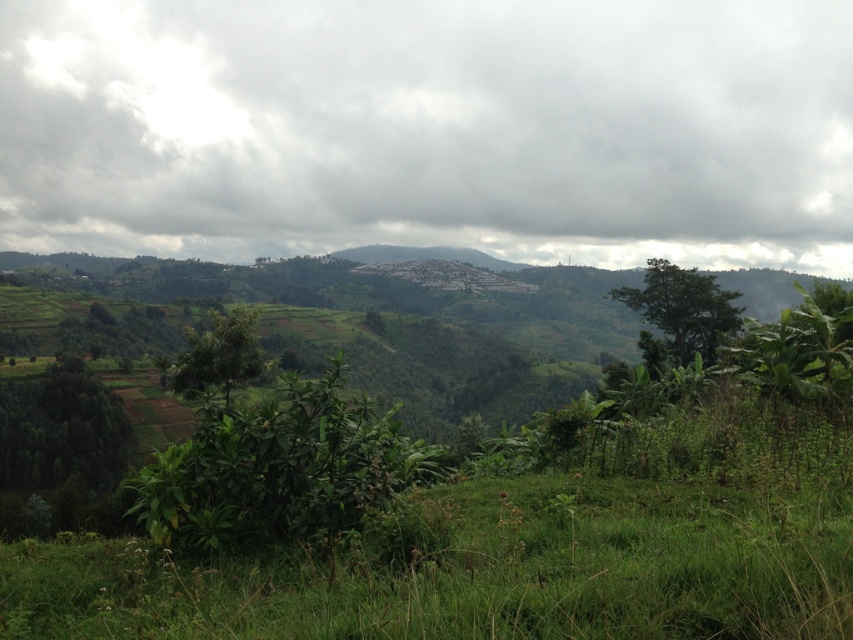
Question: Does cloudy sky at upper center appear on the left side of green leafy bush at center?

Choices:
 (A) no
 (B) yes

Answer: (B)

Question: Is cloudy sky at upper center closer to camera compared to green leafy bush at center?

Choices:
 (A) yes
 (B) no

Answer: (B)

Question: Which object is farther from the camera taking this photo?

Choices:
 (A) green leafy bush at center
 (B) cloudy sky at upper center

Answer: (B)

Question: Which point appears closest to the camera in this image?

Choices:
 (A) (708, 29)
 (B) (224, 426)

Answer: (B)

Question: Which of the following is the closest to the observer?

Choices:
 (A) cloudy sky at upper center
 (B) green leafy bush at center

Answer: (B)

Question: Considering the relative positions of cloudy sky at upper center and green leafy bush at center in the image provided, where is cloudy sky at upper center located with respect to green leafy bush at center?

Choices:
 (A) left
 (B) right

Answer: (A)